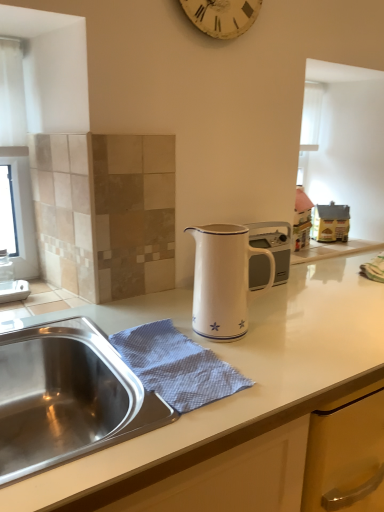
Locate an element on the screen. The width and height of the screenshot is (384, 512). vacant area on top of white glossy pitcher at center (from a real-world perspective) is located at coordinates (328, 301).